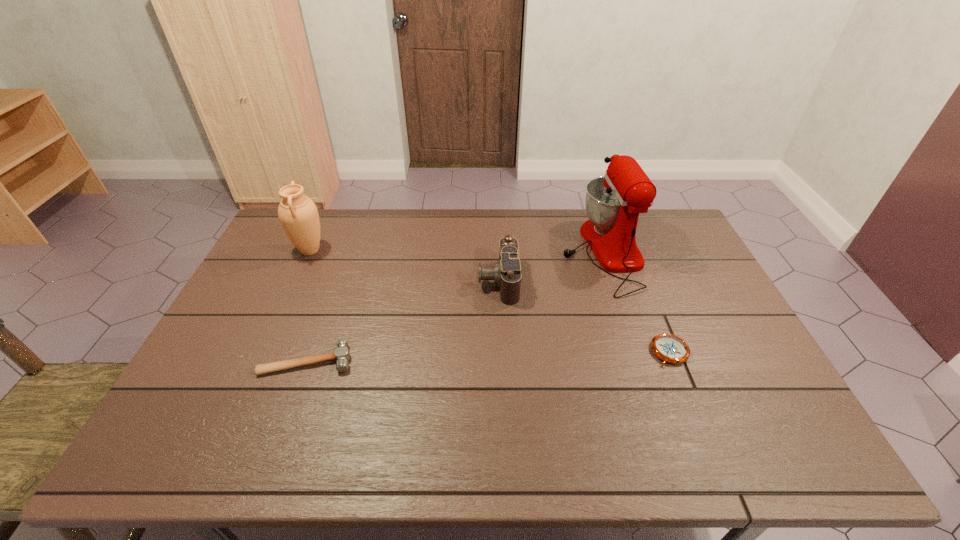
Find the location of a particular element. This screenshot has height=540, width=960. vacant space that satisfies the following two spatial constraints: 1. on the bowl side of the compass; 2. on the left side of the tallest object is located at coordinates (635, 352).

You are a GUI agent. You are given a task and a screenshot of the screen. Output one action in this format:
    pyautogui.click(x=<x>, y=<y>)
    Task: Click on the vacant space that satisfies the following two spatial constraints: 1. on the bowl side of the tallest object; 2. on the right side of the compass
    The width and height of the screenshot is (960, 540).
    Given the screenshot: What is the action you would take?
    pyautogui.click(x=635, y=352)

Where is `free point that satisfies the following two spatial constraints: 1. on the front-facing side of the third shortest object; 2. on the left side of the shortest object`? free point that satisfies the following two spatial constraints: 1. on the front-facing side of the third shortest object; 2. on the left side of the shortest object is located at coordinates (501, 352).

Locate an element on the screen. The width and height of the screenshot is (960, 540). vacant space that satisfies the following two spatial constraints: 1. on the bowl side of the tallest object; 2. on the left side of the compass is located at coordinates (635, 352).